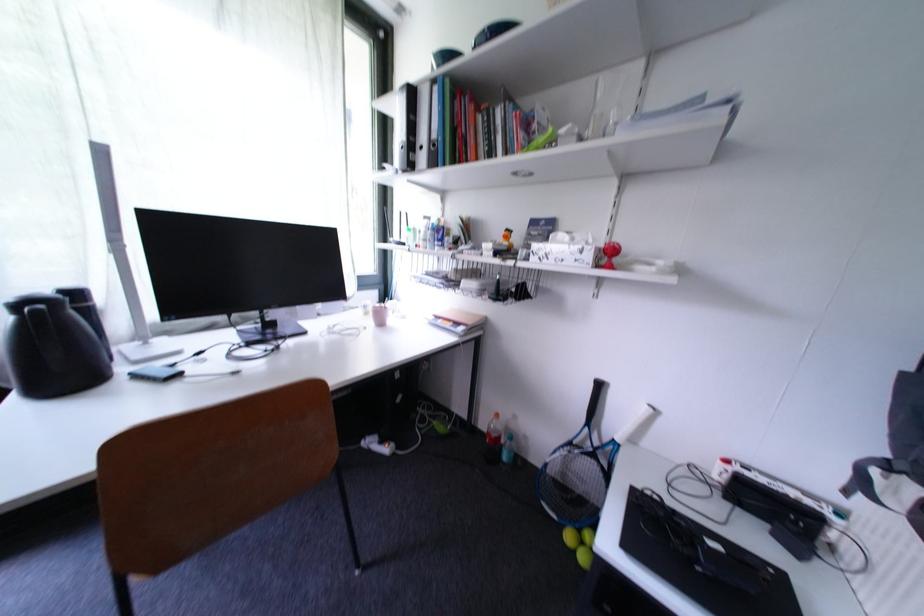
The image size is (924, 616). Find the location of `white tissue box`. white tissue box is located at coordinates (565, 249).